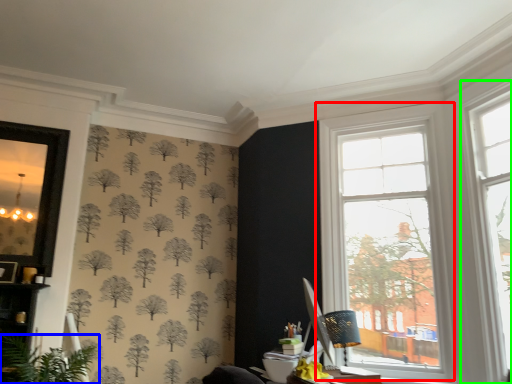
Question: Based on their relative distances, which object is nearer to window (highlighted by a red box)? Choose from houseplant (highlighted by a blue box) and window (highlighted by a green box).

Choices:
 (A) houseplant
 (B) window

Answer: (B)